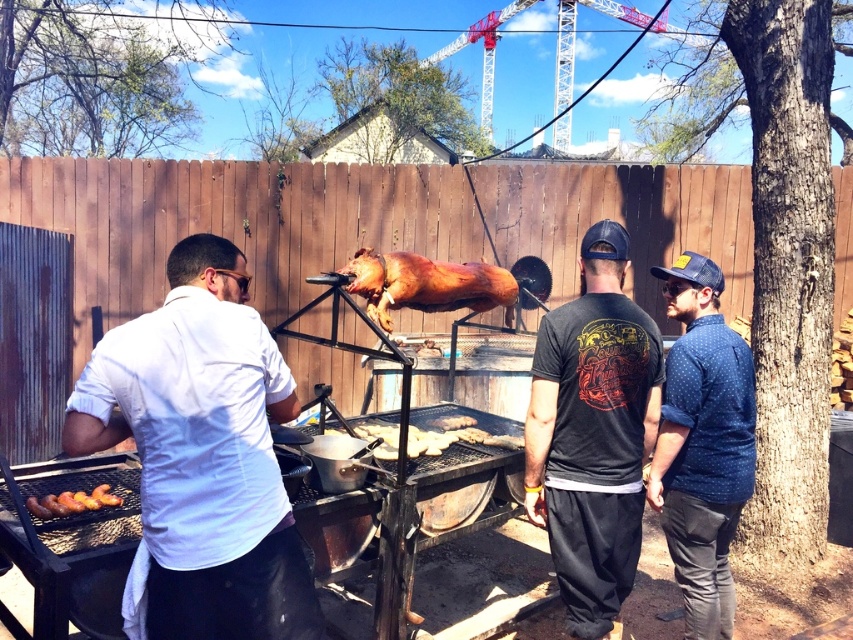
Does blue dotted shirt at right have a greater height compared to golden brown crispy pig at center?

Yes.

Does blue dotted shirt at right come behind golden brown crispy pig at center?

That is False.

Between point (717, 627) and point (486, 301), which one is positioned behind?

The point (486, 301) is behind.

Locate an element on the screen. This screenshot has height=640, width=853. blue dotted shirt at right is located at coordinates (701, 444).

Between point (421, 280) and point (90, 502), which one is positioned in front?

Positioned in front is point (90, 502).

Is golden brown crispy pig at center further to the viewer compared to charred wood sausages at lower left?

Yes, golden brown crispy pig at center is further from the viewer.

Between point (387, 324) and point (78, 509), which one is positioned in front?

Point (78, 509) is in front.

Locate an element on the screen. golden brown crispy pig at center is located at coordinates (425, 284).

Is black cotton t-shirt at center bigger than charred wood sausages at lower left?

Yes, black cotton t-shirt at center is bigger than charred wood sausages at lower left.

Is black cotton t-shirt at center to the right of charred wood sausages at lower left from the viewer's perspective?

Indeed, black cotton t-shirt at center is positioned on the right side of charred wood sausages at lower left.

Is point (618, 365) more distant than point (30, 509)?

That is True.

Where is `black cotton t-shirt at center`? The width and height of the screenshot is (853, 640). black cotton t-shirt at center is located at coordinates (593, 433).